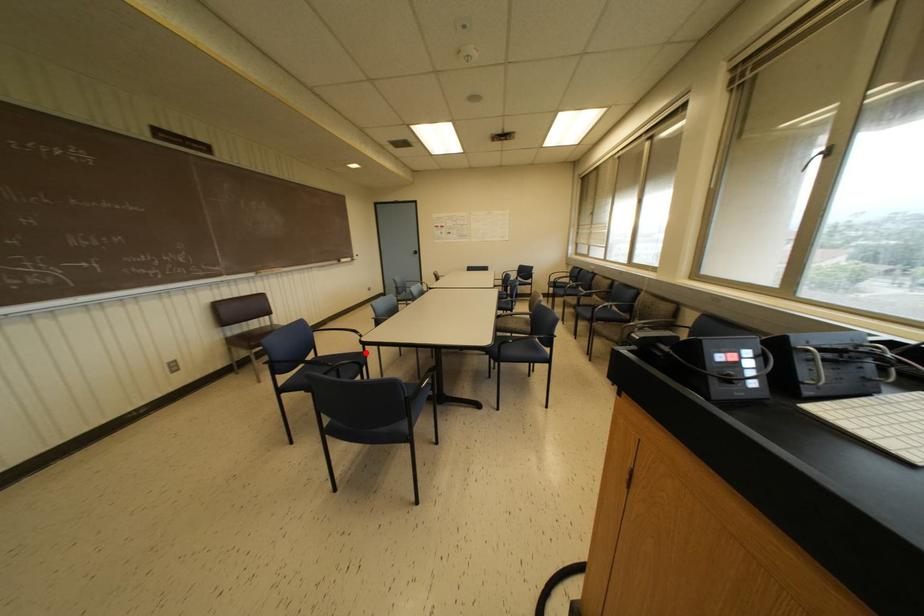
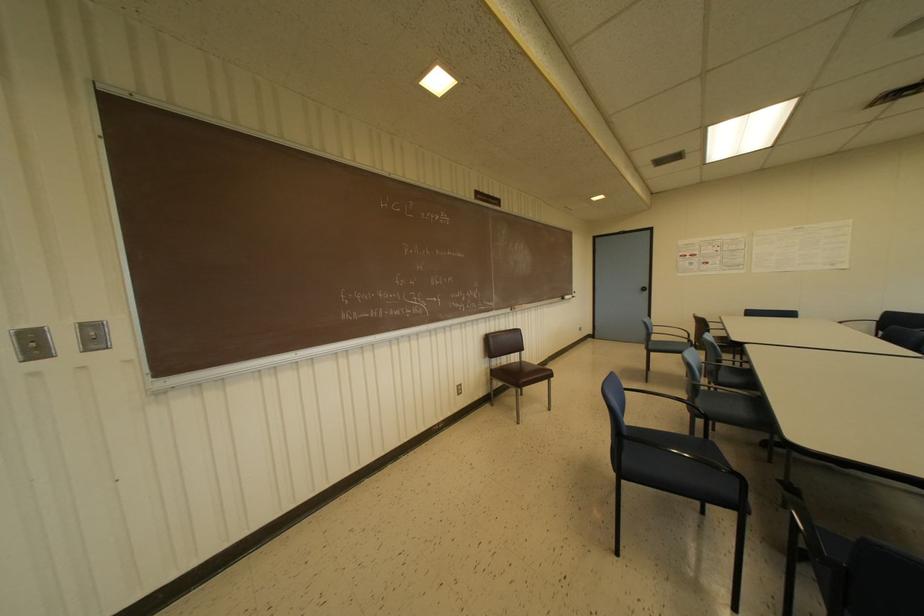
Question: A red point is marked in image1. In image2, is the corresponding 3D point closer to the camera or farther? Reply with the corresponding letter.

Choices:
 (A) The corresponding 3D point is closer.
 (B) The corresponding 3D point is farther.

Answer: (B)